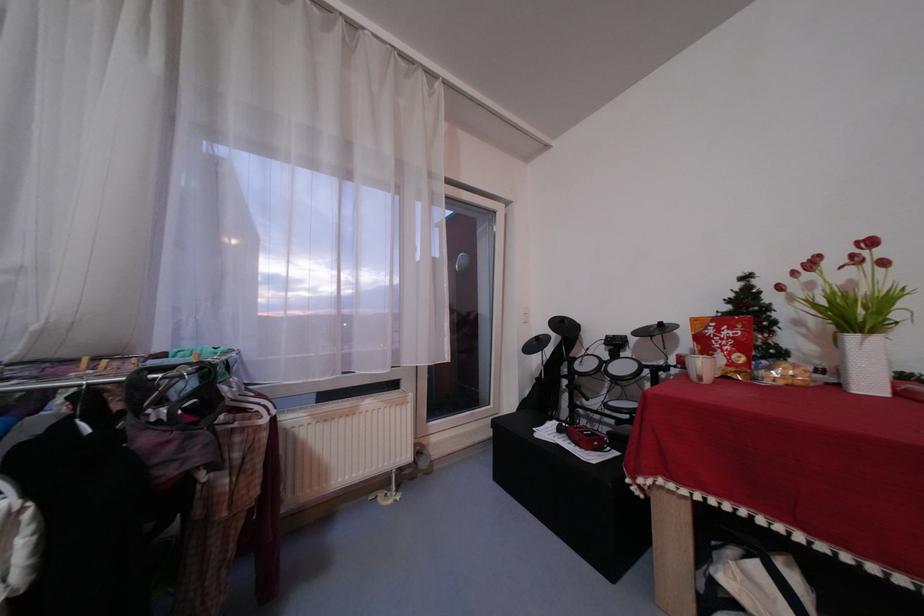
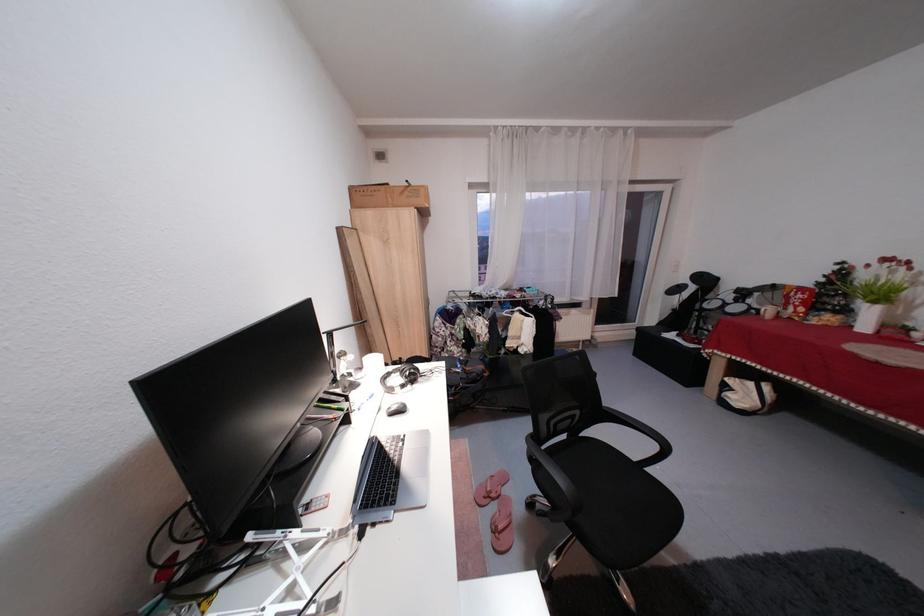
The point at (881, 387) is marked in the first image. Where is the corresponding point in the second image?

(877, 330)